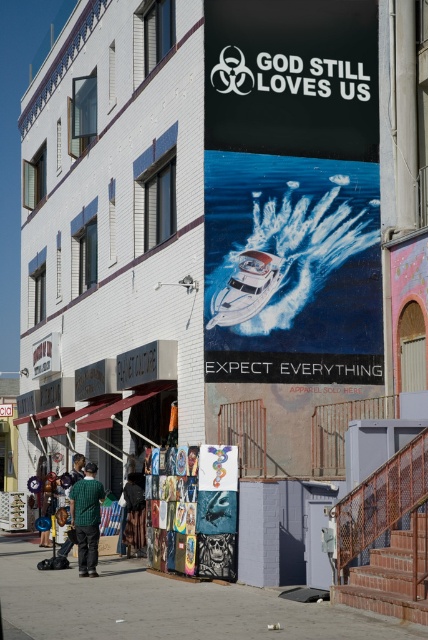
Looking at this image, you are standing in the middle of the street looking at the large mural on the building. There is a metallic silver painting at center. Can you tell me the exact coordinates of the metallic silver paintings at center?

The metallic silver paintings at center is located at point (211, 515).

You are standing in front of the mural on the building. You notice two points marked on the mural at coordinates point (229, 246) and point (101, 483). Which point is closer to your current position?

Point (229, 246) is closer to the camera than point (101, 483), so the point closer to your current position is point (229, 246).